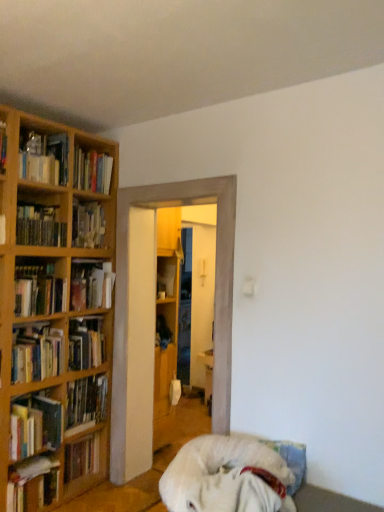
Question: Does matte wooden bookshelf at left, marked as the 1th book in a top-to-bottom arrangement, have a lesser height compared to hardcover book at left, the 3th book positioned from the bottom?

Choices:
 (A) yes
 (B) no

Answer: (B)

Question: Considering the relative sizes of matte wooden bookshelf at left, the eleventh book positioned from the bottom, and hardcover book at left, arranged as the 9th book when viewed from the top, in the image provided, is matte wooden bookshelf at left, the eleventh book positioned from the bottom, taller than hardcover book at left, arranged as the 9th book when viewed from the top,?

Choices:
 (A) no
 (B) yes

Answer: (B)

Question: Is matte wooden bookshelf at left, marked as the 1th book in a top-to-bottom arrangement, next to hardcover book at left, arranged as the 9th book when viewed from the top?

Choices:
 (A) no
 (B) yes

Answer: (A)

Question: Does matte wooden bookshelf at left, marked as the 1th book in a top-to-bottom arrangement, come behind hardcover book at left, the 3th book positioned from the bottom?

Choices:
 (A) yes
 (B) no

Answer: (A)

Question: Looking at their shapes, would you say wooden bookshelf at left, arranged as the tenth book when ordered from the bottom, is wider or thinner than hardcover book at left, arranged as the 7th book when ordered from the bottom?

Choices:
 (A) wide
 (B) thin

Answer: (A)

Question: Considering the positions of point [33, 221] and point [21, 309], is point [33, 221] closer or farther from the camera than point [21, 309]?

Choices:
 (A) closer
 (B) farther

Answer: (B)

Question: From a real-world perspective, is wooden bookshelf at left, arranged as the tenth book when ordered from the bottom, physically located above or below hardcover book at left, acting as the 5th book starting from the top?

Choices:
 (A) below
 (B) above

Answer: (B)

Question: From the image's perspective, relative to hardcover book at left, arranged as the 7th book when ordered from the bottom, is wooden bookshelf at left, arranged as the tenth book when ordered from the bottom, above or below?

Choices:
 (A) below
 (B) above

Answer: (B)

Question: Is wooden bookshelf at left, the second book when ordered from top to bottom, to the left or to the right of wooden bookshelf at center, which ranks as the fourth book in top-to-bottom order, in the image?

Choices:
 (A) right
 (B) left

Answer: (B)

Question: Is wooden bookshelf at left, the second book when ordered from top to bottom, taller or shorter than wooden bookshelf at center, which ranks as the fourth book in top-to-bottom order?

Choices:
 (A) short
 (B) tall

Answer: (B)

Question: Considering the positions of wooden bookshelf at left, arranged as the tenth book when ordered from the bottom, and wooden bookshelf at center, the eighth book when ordered from bottom to top, in the image, is wooden bookshelf at left, arranged as the tenth book when ordered from the bottom, wider or thinner than wooden bookshelf at center, the eighth book when ordered from bottom to top,?

Choices:
 (A) thin
 (B) wide

Answer: (B)

Question: From a real-world perspective, relative to wooden bookshelf at center, which ranks as the fourth book in top-to-bottom order, is wooden bookshelf at left, the second book when ordered from top to bottom, vertically above or below?

Choices:
 (A) below
 (B) above

Answer: (B)

Question: Considering the positions of wooden cabinet at center and hardcover book at left, the 4th book from the bottom, in the image, is wooden cabinet at center taller or shorter than hardcover book at left, the 4th book from the bottom,?

Choices:
 (A) short
 (B) tall

Answer: (A)

Question: Does point (162, 333) appear closer or farther from the camera than point (102, 408)?

Choices:
 (A) closer
 (B) farther

Answer: (B)